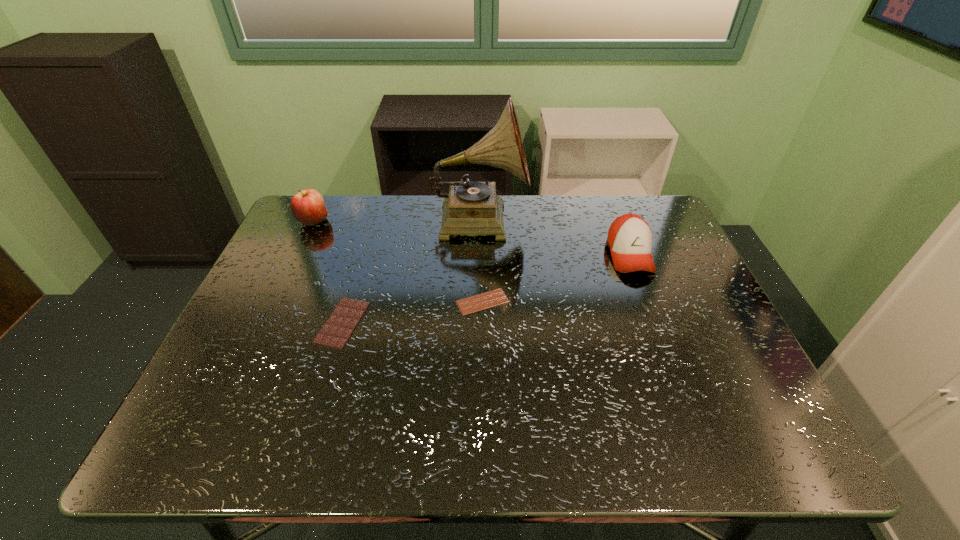
You are a GUI agent. You are given a task and a screenshot of the screen. Output one action in this format:
    pyautogui.click(x=<x>, y=<y>)
    Task: Click on the free space at the near edge of the desktop
    The height and width of the screenshot is (540, 960).
    Given the screenshot: What is the action you would take?
    pyautogui.click(x=360, y=416)

This screenshot has height=540, width=960. Identify the location of vacant space at the left edge of the desktop. (249, 377).

The height and width of the screenshot is (540, 960). I want to click on vacant area at the right edge, so click(655, 254).

I want to click on free point at the near left corner, so click(x=212, y=442).

I want to click on vacant space at the far right corner of the desktop, so click(674, 237).

Where is `vacant space at the near right corner of the desktop`? The image size is (960, 540). vacant space at the near right corner of the desktop is located at coordinates (762, 418).

Locate an element on the screen. Image resolution: width=960 pixels, height=540 pixels. vacant point located between the apple and the tallest object is located at coordinates (396, 220).

Identify the location of free point between the record player and the fourth tallest object. (411, 271).

Find the location of `free space that is in between the rightmost object and the leftmost object`. free space that is in between the rightmost object and the leftmost object is located at coordinates (471, 238).

Where is `free area in between the leftmost object and the baseball cap`? The image size is (960, 540). free area in between the leftmost object and the baseball cap is located at coordinates (471, 238).